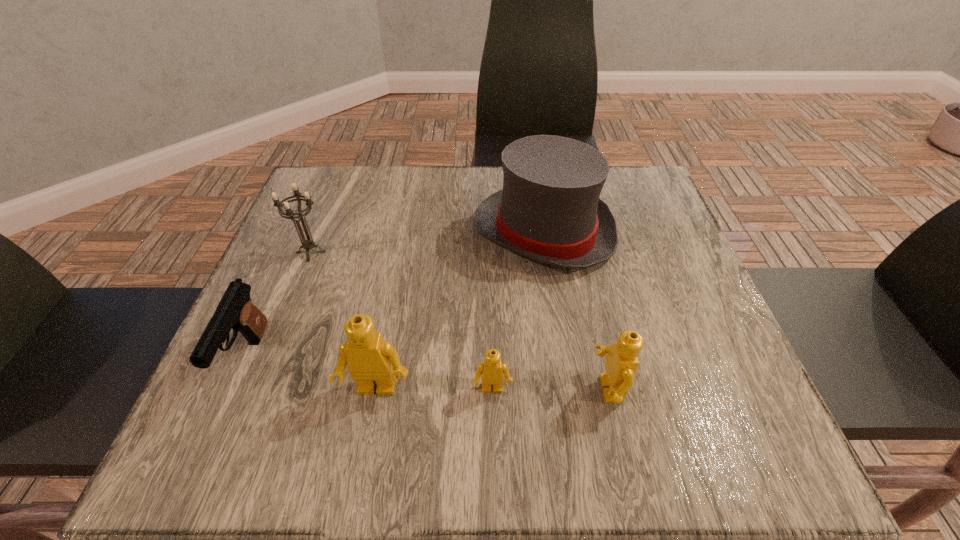
This screenshot has height=540, width=960. What are the coordinates of `vacant space at the near edge of the desktop` in the screenshot? It's located at (400, 409).

Locate an element on the screen. This screenshot has height=540, width=960. blank space at the left edge is located at coordinates (292, 291).

Where is `free location at the right edge of the desktop`? This screenshot has height=540, width=960. free location at the right edge of the desktop is located at coordinates pyautogui.click(x=651, y=293).

Find the location of a particular element. This screenshot has width=960, height=540. vacant space at the far left corner of the desktop is located at coordinates (329, 180).

The height and width of the screenshot is (540, 960). Find the location of `vacant space at the far right corner of the desktop`. vacant space at the far right corner of the desktop is located at coordinates (656, 192).

Find the location of `free spot at the near right corner of the desktop`. free spot at the near right corner of the desktop is located at coordinates (669, 377).

Locate an element on the screen. blank region between the candle holder and the leftmost Lego is located at coordinates (344, 321).

The width and height of the screenshot is (960, 540). I want to click on vacant area between the candle holder and the pistol, so click(279, 306).

Locate an element on the screen. The width and height of the screenshot is (960, 540). free space between the dress hat and the leftmost Lego is located at coordinates pos(460,310).

The height and width of the screenshot is (540, 960). What are the coordinates of `vacant point located between the leftmost Lego and the shortest object` in the screenshot? It's located at (434, 389).